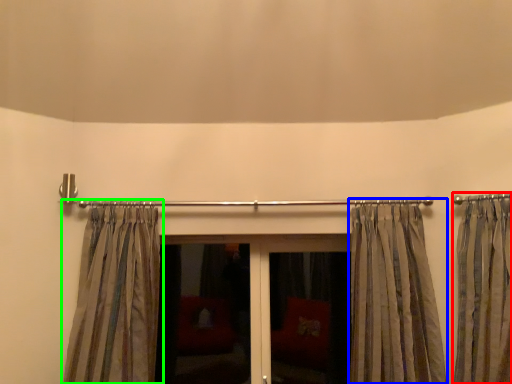
Question: Considering the real-world distances, which object is closest to curtain (highlighted by a red box)? curtain (highlighted by a blue box) or curtain (highlighted by a green box).

Choices:
 (A) curtain
 (B) curtain

Answer: (A)